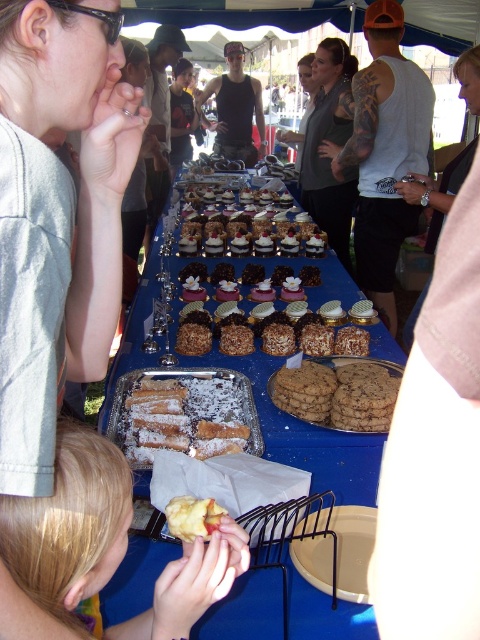
Between smooth chocolate cake at center and smooth yellow cake at lower left, which one appears on the right side from the viewer's perspective?

smooth chocolate cake at center is more to the right.

Which is above, smooth chocolate cake at center or smooth yellow cake at lower left?

smooth chocolate cake at center is higher up.

Locate an element on the screen. smooth chocolate cake at center is located at coordinates (255, 408).

Does smooth yellow cake at lower left have a lesser width compared to yellow matte apple at lower center?

No.

Is smooth yellow cake at lower left smaller than yellow matte apple at lower center?

No.

Locate an element on the screen. The width and height of the screenshot is (480, 640). smooth yellow cake at lower left is located at coordinates (70, 524).

Between gray fabric shirt at center and chocolate chip cookie at center, which one has less height?

Standing shorter between the two is chocolate chip cookie at center.

Is the position of gray fabric shirt at center more distant than that of chocolate chip cookie at center?

Yes.

Is point (302, 180) in front of point (370, 408)?

No, (302, 180) is further to viewer.

Identify the location of gray fabric shirt at center. (332, 144).